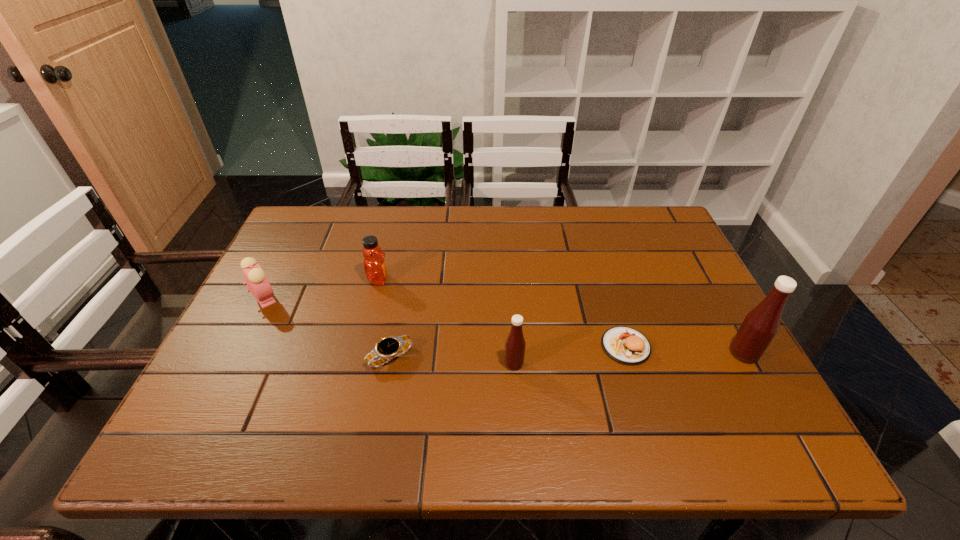
Please show where to add a Tabasco sauce on the left while keeping spacing even. Please provide its 2D coordinates. Your answer should be formatted as a tuple, i.e. [(x, y)], where the tuple contains the x and y coordinates of a point satisfying the conditions above.

[(274, 375)]